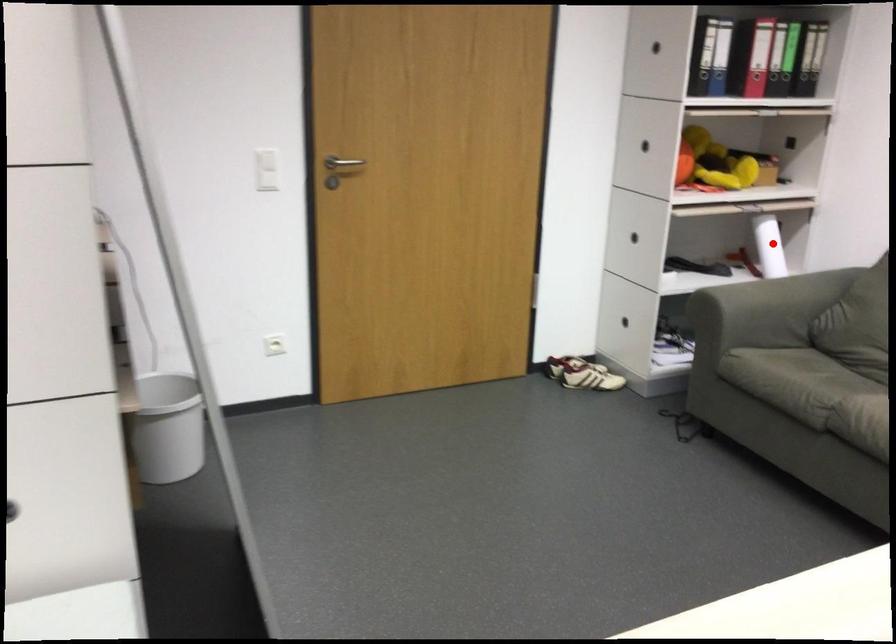
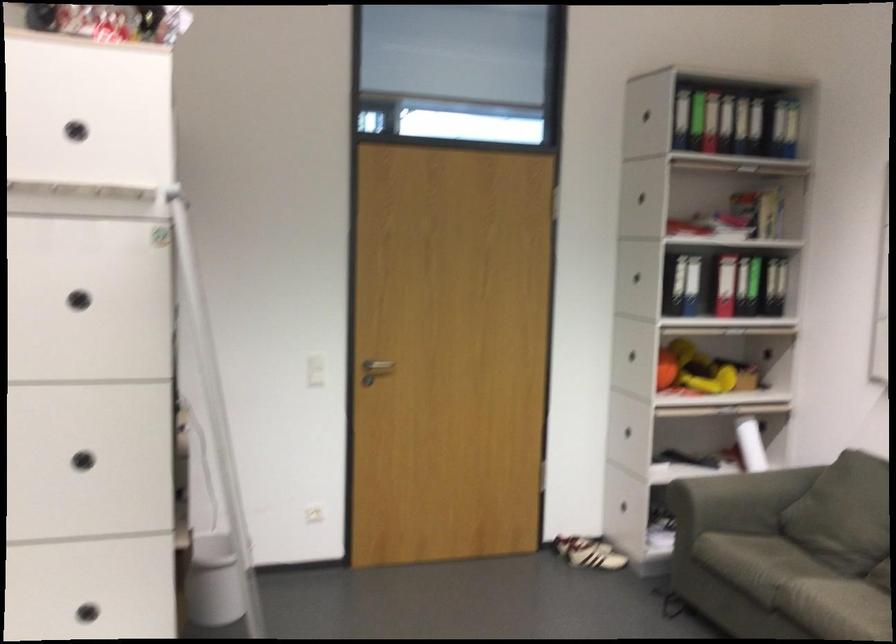
The point at the highlighted location is marked in the first image. Where is the corresponding point in the second image?

(750, 444)